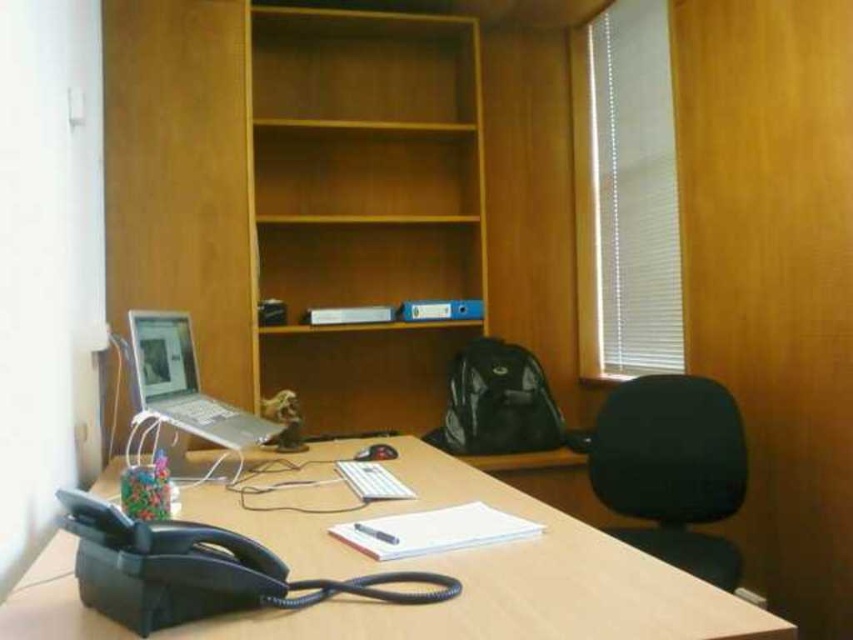
You are a person who needs to reach the silver metallic laptop at left from the black fabric swivel chair at right. Can you comfortably reach the laptop without moving your chair?

The distance between the black fabric swivel chair at right and the silver metallic laptop at left is 1.17 meters. Considering typical arm reach, which is about 0.5 to 0.7 meters, you would need to move the chair closer to comfortably reach the laptop.